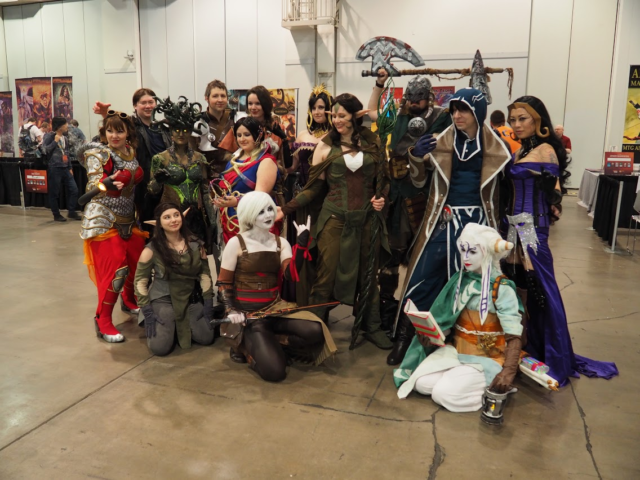
This screenshot has height=480, width=640. What are the coordinates of `poster` in the screenshot? It's located at (25, 85), (60, 91), (6, 113).